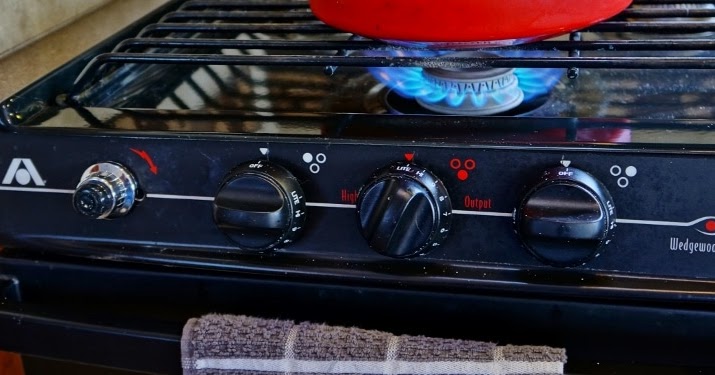
This screenshot has width=715, height=375. In order to click on red stove label in this screenshot , I will do `click(147, 158)`, `click(347, 195)`, `click(408, 154)`, `click(452, 158)`, `click(470, 165)`, `click(463, 174)`, `click(478, 202)`, `click(711, 224)`.